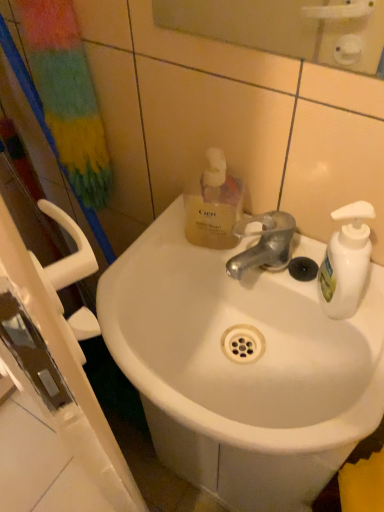
Question: Is translucent yellow liquid at upper center further to the viewer compared to glossy plastic mirror at upper center?

Choices:
 (A) yes
 (B) no

Answer: (A)

Question: From a real-world perspective, is translucent yellow liquid at upper center over glossy plastic mirror at upper center?

Choices:
 (A) no
 (B) yes

Answer: (A)

Question: Does translucent yellow liquid at upper center turn towards glossy plastic mirror at upper center?

Choices:
 (A) yes
 (B) no

Answer: (B)

Question: Is translucent yellow liquid at upper center in front of glossy plastic mirror at upper center?

Choices:
 (A) yes
 (B) no

Answer: (B)

Question: Can you see translucent yellow liquid at upper center touching glossy plastic mirror at upper center?

Choices:
 (A) yes
 (B) no

Answer: (B)

Question: Would you say translucent yellow liquid at upper center is to the left or to the right of white ceramic sink at center in the picture?

Choices:
 (A) left
 (B) right

Answer: (A)

Question: Does point (215, 195) appear closer or farther from the camera than point (322, 373)?

Choices:
 (A) closer
 (B) farther

Answer: (B)

Question: Looking at their shapes, would you say translucent yellow liquid at upper center is wider or thinner than white ceramic sink at center?

Choices:
 (A) wide
 (B) thin

Answer: (B)

Question: Is translucent yellow liquid at upper center taller or shorter than white ceramic sink at center?

Choices:
 (A) short
 (B) tall

Answer: (B)

Question: From the image's perspective, is glossy plastic mirror at upper center above or below white ceramic sink at center?

Choices:
 (A) below
 (B) above

Answer: (B)

Question: Considering their positions, is glossy plastic mirror at upper center located in front of or behind white ceramic sink at center?

Choices:
 (A) behind
 (B) front

Answer: (B)

Question: Would you say glossy plastic mirror at upper center is inside or outside white ceramic sink at center?

Choices:
 (A) outside
 (B) inside

Answer: (A)

Question: Visually, is glossy plastic mirror at upper center positioned to the left or to the right of white ceramic sink at center?

Choices:
 (A) right
 (B) left

Answer: (A)

Question: Is white ceramic sink at center spatially inside glossy plastic mirror at upper center, or outside of it?

Choices:
 (A) outside
 (B) inside

Answer: (A)

Question: Is white ceramic sink at center taller or shorter than glossy plastic mirror at upper center?

Choices:
 (A) short
 (B) tall

Answer: (A)